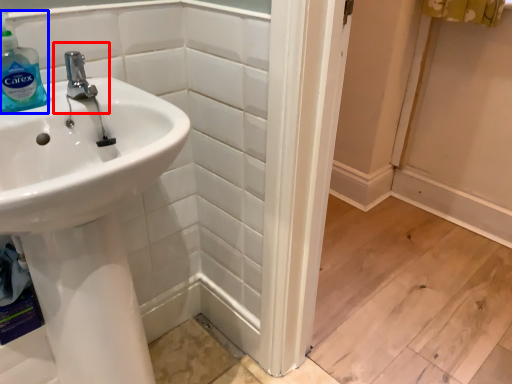
Question: Among these objects, which one is farthest to the camera, plumbing fixture (highlighted by a red box) or cleaning product (highlighted by a blue box)?

Choices:
 (A) plumbing fixture
 (B) cleaning product

Answer: (A)